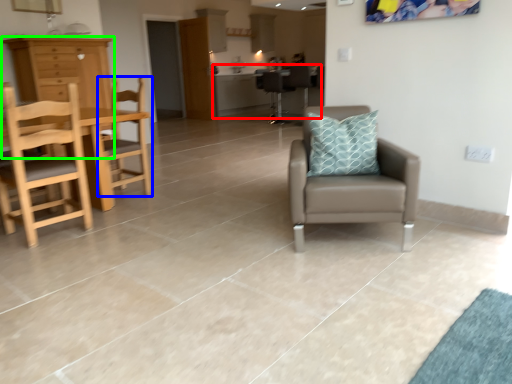
Question: Estimate the real-world distances between objects in this image. Which object is farther from table (highlighted by a red box), chair (highlighted by a blue box) or cabinetry (highlighted by a green box)?

Choices:
 (A) chair
 (B) cabinetry

Answer: (B)